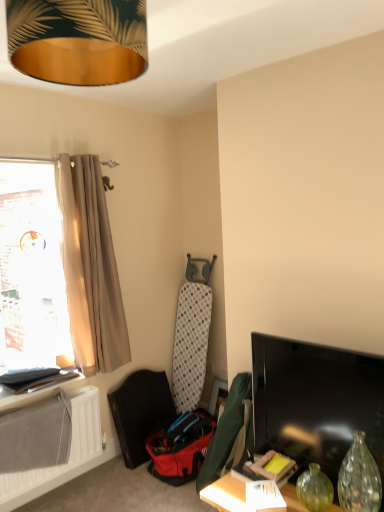
Question: Can you confirm if transparent glass vase at lower right is smaller than gold metallic lampshade at upper center?

Choices:
 (A) no
 (B) yes

Answer: (B)

Question: Is transparent glass vase at lower right with gold metallic lampshade at upper center?

Choices:
 (A) no
 (B) yes

Answer: (A)

Question: Is transparent glass vase at lower right taller than gold metallic lampshade at upper center?

Choices:
 (A) no
 (B) yes

Answer: (B)

Question: From the image's perspective, is transparent glass vase at lower right located above gold metallic lampshade at upper center?

Choices:
 (A) no
 (B) yes

Answer: (A)

Question: Is transparent glass vase at lower right completely or partially outside of gold metallic lampshade at upper center?

Choices:
 (A) yes
 (B) no

Answer: (A)

Question: Is transparent glass vase at lower right to the right of gold metallic lampshade at upper center from the viewer's perspective?

Choices:
 (A) yes
 (B) no

Answer: (A)

Question: Can you confirm if gold metallic lampshade at upper center is bigger than matte black shelf at lower left?

Choices:
 (A) no
 (B) yes

Answer: (B)

Question: Can you confirm if gold metallic lampshade at upper center is thinner than matte black shelf at lower left?

Choices:
 (A) yes
 (B) no

Answer: (B)

Question: Considering the relative sizes of gold metallic lampshade at upper center and matte black shelf at lower left in the image provided, is gold metallic lampshade at upper center smaller than matte black shelf at lower left?

Choices:
 (A) yes
 (B) no

Answer: (B)

Question: Does gold metallic lampshade at upper center lie in front of matte black shelf at lower left?

Choices:
 (A) no
 (B) yes

Answer: (B)

Question: Can you confirm if gold metallic lampshade at upper center is positioned to the right of matte black shelf at lower left?

Choices:
 (A) yes
 (B) no

Answer: (A)

Question: Is gold metallic lampshade at upper center at the left side of matte black shelf at lower left?

Choices:
 (A) no
 (B) yes

Answer: (A)

Question: Does gold metallic lampshade at upper center touch matte green picture frame at lower right?

Choices:
 (A) no
 (B) yes

Answer: (A)